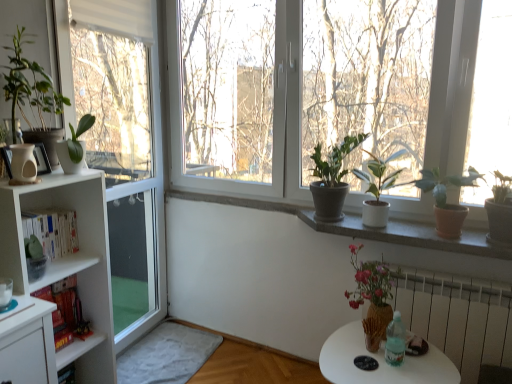
Question: Should I look upward or downward to see white glossy table at lower right?

Choices:
 (A) down
 (B) up

Answer: (A)

Question: Does green matte plant at left, which appears as the 2th houseplant when viewed from the left, lie behind white glossy table at lower right?

Choices:
 (A) yes
 (B) no

Answer: (A)

Question: Can you confirm if green matte plant at left, positioned as the 5th houseplant in right-to-left order, is positioned to the right of white glossy table at lower right?

Choices:
 (A) yes
 (B) no

Answer: (B)

Question: Is green matte plant at left, positioned as the 5th houseplant in right-to-left order, completely or partially outside of white glossy table at lower right?

Choices:
 (A) yes
 (B) no

Answer: (A)

Question: Is green matte plant at left, positioned as the 5th houseplant in right-to-left order, taller than white glossy table at lower right?

Choices:
 (A) yes
 (B) no

Answer: (B)

Question: Can white glossy table at lower right be found inside green matte plant at left, which appears as the 2th houseplant when viewed from the left?

Choices:
 (A) no
 (B) yes

Answer: (A)

Question: From the image's perspective, would you say green matte plant at left, which appears as the 2th houseplant when viewed from the left, is positioned over white glossy table at lower right?

Choices:
 (A) no
 (B) yes

Answer: (B)

Question: Is white soft carpet at lower left further to camera compared to white radiator at lower right?

Choices:
 (A) no
 (B) yes

Answer: (B)

Question: Does white soft carpet at lower left touch white radiator at lower right?

Choices:
 (A) yes
 (B) no

Answer: (B)

Question: Could you tell me if white soft carpet at lower left is facing white radiator at lower right?

Choices:
 (A) no
 (B) yes

Answer: (A)

Question: From a real-world perspective, is white soft carpet at lower left beneath white radiator at lower right?

Choices:
 (A) no
 (B) yes

Answer: (B)

Question: Are white soft carpet at lower left and white radiator at lower right located far from each other?

Choices:
 (A) no
 (B) yes

Answer: (B)

Question: From a real-world perspective, is white soft carpet at lower left physically above white radiator at lower right?

Choices:
 (A) no
 (B) yes

Answer: (A)

Question: Can you confirm if matte brown vase with flowers at lower right is bigger than white concrete window sill at center?

Choices:
 (A) no
 (B) yes

Answer: (B)